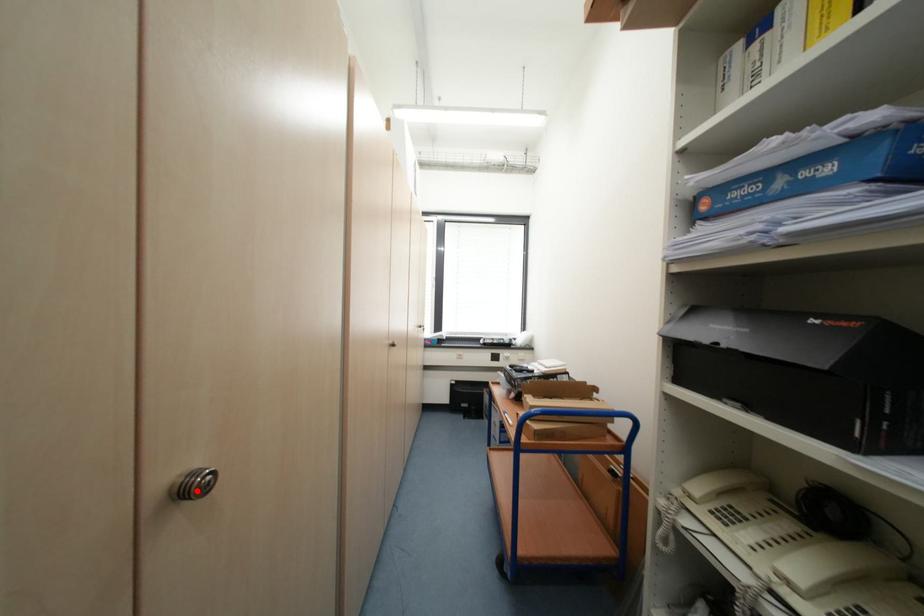
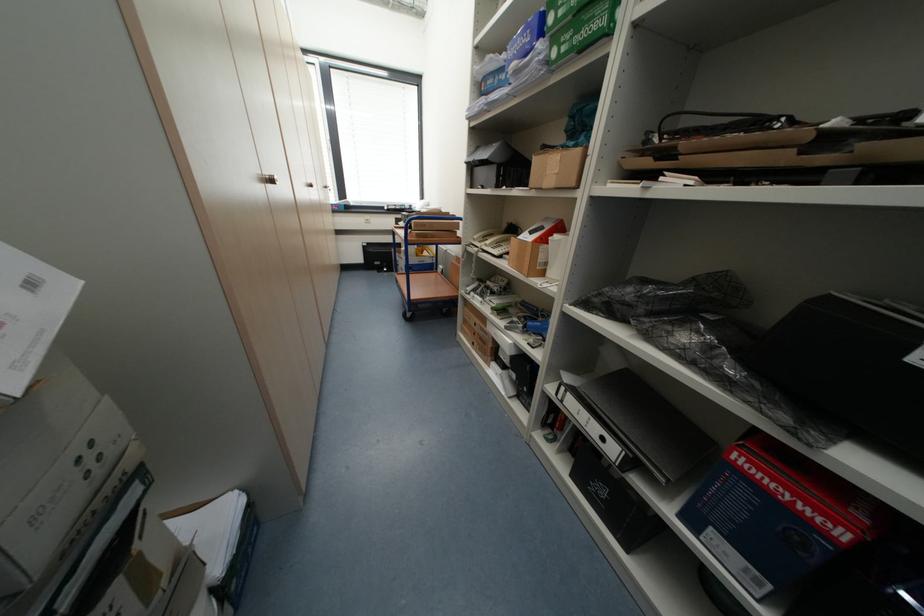
Where in the second image is the point corresponding to the highlighted location from the first image?

(278, 182)